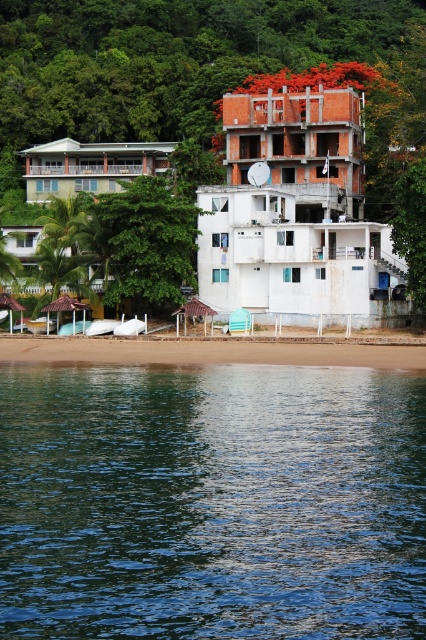
Between clear blue water at lower center and brown sand at lower center, which one is positioned lower?

clear blue water at lower center is below.

Can you confirm if clear blue water at lower center is positioned above brown sand at lower center?

No, clear blue water at lower center is not above brown sand at lower center.

Which is in front, point (28, 508) or point (55, 342)?

Positioned in front is point (28, 508).

Identify the location of clear blue water at lower center. (212, 502).

Does white concrete building at upper center have a lesser height compared to brown sand at lower center?

In fact, white concrete building at upper center may be taller than brown sand at lower center.

Does point (333, 227) come behind point (195, 344)?

Yes.

Identify the location of white concrete building at upper center. This screenshot has height=640, width=426. (296, 211).

Which is above, white concrete building at upper center or white matte building at center?

white matte building at center is above.

Is point (348, 227) farther from viewer compared to point (114, 177)?

No, (348, 227) is in front of (114, 177).

You are a GUI agent. You are given a task and a screenshot of the screen. Output one action in this format:
    pyautogui.click(x=<x>, y=<y>)
    Task: Click on the white concrete building at upper center
    The width and height of the screenshot is (426, 640).
    Given the screenshot: What is the action you would take?
    pyautogui.click(x=296, y=211)

Where is `white concrete building at upper center`? white concrete building at upper center is located at coordinates (296, 211).